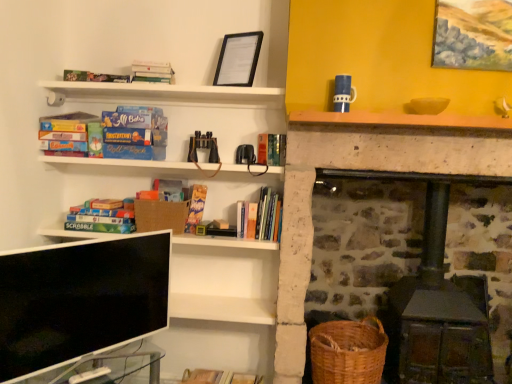
Question: Considering the relative positions of matte cardboard board game at left, the 3th book positioned from the top, and oil painting at upper right, placed as the 1th picture frame when sorted from front to back, in the image provided, is matte cardboard board game at left, the 3th book positioned from the top, to the left or to the right of oil painting at upper right, placed as the 1th picture frame when sorted from front to back,?

Choices:
 (A) right
 (B) left

Answer: (B)

Question: Considering the positions of point (78, 117) and point (463, 59), is point (78, 117) closer or farther from the camera than point (463, 59)?

Choices:
 (A) closer
 (B) farther

Answer: (B)

Question: Estimate the real-world distances between objects in this image. Which object is closer to the burlap basket at lower left, which is counted as the 1th basket, starting from the top?

Choices:
 (A) matte green board game at left, the 5th book when ordered from top to bottom
 (B) hardcover book at center, arranged as the 3th paperback book when viewed from the left
 (C) hardcover book at center, the 5th book viewed from the left
 (D) black matte picture frame at upper center, which ranks as the first picture frame in back-to-front order
 (E) oil painting at upper right, which is the 1th picture frame in right-to-left order

Answer: (B)

Question: Based on their relative distances, which object is farther from the hardcover book at upper left, the second book viewed from the top?

Choices:
 (A) green matte scrabble board game at lower left, marked as the 3th paperback book in a right-to-left arrangement
 (B) matte cardboard board game at left, marked as the fifth book in a right-to-left arrangement
 (C) woven brown basket at lower right, the first basket from the right
 (D) transparent glass table at lower left
 (E) matte green board game at left, positioned as the 1th book in bottom-to-top order

Answer: (C)